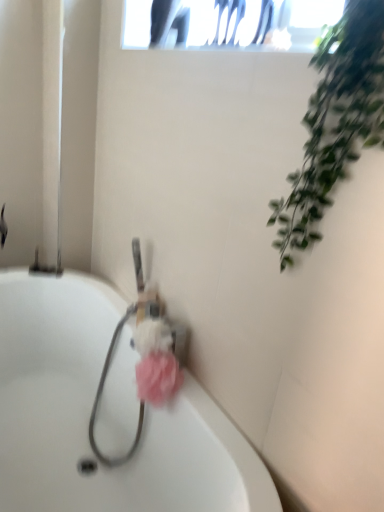
Image resolution: width=384 pixels, height=512 pixels. Describe the element at coordinates (335, 121) in the screenshot. I see `green leafy plant at upper right` at that location.

Identify the location of white glossy bathtub at center. The width and height of the screenshot is (384, 512). (90, 412).

What are the coordinates of `green leafy plant at upper right` in the screenshot? It's located at (335, 121).

The width and height of the screenshot is (384, 512). Identify the location of bathtub that is behind the green leafy plant at upper right. (90, 412).

From the image's perspective, is green leafy plant at upper right below white glossy bathtub at center?

Actually, green leafy plant at upper right appears above white glossy bathtub at center in the image.

From a real-world perspective, is green leafy plant at upper right located beneath white glossy bathtub at center?

No.

In the scene shown: Are green leafy plant at upper right and white glossy bathtub at center far apart?

Actually, green leafy plant at upper right and white glossy bathtub at center are a little close together.

Is pink fluffy sponge at center, which is counted as the first flower, starting from the bottom, surrounded by pink fluffy sponge at center?

No, pink fluffy sponge at center, which is counted as the first flower, starting from the bottom, is located outside of pink fluffy sponge at center.

Where is `sink that is behind the pink fluffy sponge at center, the second flower positioned from the top`? The image size is (384, 512). sink that is behind the pink fluffy sponge at center, the second flower positioned from the top is located at coordinates (115, 344).

In the scene shown: Is pink fluffy sponge at center next to pink fluffy sponge at center, which is counted as the first flower, starting from the bottom?

No, pink fluffy sponge at center is not touching pink fluffy sponge at center, which is counted as the first flower, starting from the bottom.

Is pink fluffy loofah at center, acting as the second flower starting from the bottom, thinner than pink fluffy sponge at center, the second flower positioned from the top?

In fact, pink fluffy loofah at center, acting as the second flower starting from the bottom, might be wider than pink fluffy sponge at center, the second flower positioned from the top.

From the image's perspective, which is above, pink fluffy loofah at center, positioned as the 1th flower in top-to-bottom order, or pink fluffy sponge at center, which is counted as the first flower, starting from the bottom?

pink fluffy loofah at center, positioned as the 1th flower in top-to-bottom order, from the image's perspective.

Which is more to the left, pink fluffy loofah at center, acting as the second flower starting from the bottom, or pink fluffy sponge at center, which is counted as the first flower, starting from the bottom?

pink fluffy loofah at center, acting as the second flower starting from the bottom.

Between pink fluffy sponge at center, which is counted as the first flower, starting from the bottom, and green leafy plant at upper right, which one has less height?

With less height is pink fluffy sponge at center, which is counted as the first flower, starting from the bottom.

From a real-world perspective, is pink fluffy sponge at center, the second flower positioned from the top, above or below green leafy plant at upper right?

Clearly, from a real-world perspective, pink fluffy sponge at center, the second flower positioned from the top, is below green leafy plant at upper right.

Between pink fluffy sponge at center, the second flower positioned from the top, and green leafy plant at upper right, which one is positioned in front?

green leafy plant at upper right is more forward.

From the image's perspective, which one is positioned lower, pink fluffy sponge at center, the second flower positioned from the top, or green leafy plant at upper right?

pink fluffy sponge at center, the second flower positioned from the top, appears lower in the image.

From a real-world perspective, is pink fluffy sponge at center physically located above or below green leafy plant at upper right?

pink fluffy sponge at center is below green leafy plant at upper right.

Can you tell me how much pink fluffy sponge at center and green leafy plant at upper right differ in facing direction?

pink fluffy sponge at center and green leafy plant at upper right are facing 3.44 degrees away from each other.

Which object is more forward, pink fluffy sponge at center or green leafy plant at upper right?

green leafy plant at upper right is in front.

Would you say pink fluffy sponge at center is inside or outside green leafy plant at upper right?

pink fluffy sponge at center exists outside the volume of green leafy plant at upper right.

Considering the positions of point (239, 478) and point (141, 339), is point (239, 478) closer or farther from the camera than point (141, 339)?

Point (239, 478) is positioned closer to the camera compared to point (141, 339).

Which of these two, white glossy bathtub at center or pink fluffy loofah at center, positioned as the 1th flower in top-to-bottom order, stands shorter?

pink fluffy loofah at center, positioned as the 1th flower in top-to-bottom order, is shorter.

Based on the photo, is white glossy bathtub at center positioned with its back to pink fluffy loofah at center, acting as the second flower starting from the bottom?

white glossy bathtub at center does not have its back to pink fluffy loofah at center, acting as the second flower starting from the bottom.

Considering the relative positions of white glossy bathtub at center and pink fluffy loofah at center, acting as the second flower starting from the bottom, in the image provided, is white glossy bathtub at center to the left of pink fluffy loofah at center, acting as the second flower starting from the bottom, from the viewer's perspective?

Yes, white glossy bathtub at center is to the left of pink fluffy loofah at center, acting as the second flower starting from the bottom.

From a real-world perspective, who is located higher, green leafy plant at upper right or pink fluffy loofah at center, positioned as the 1th flower in top-to-bottom order?

From a 3D spatial view, green leafy plant at upper right is above.

Does green leafy plant at upper right have a larger size compared to pink fluffy loofah at center, positioned as the 1th flower in top-to-bottom order?

Indeed, green leafy plant at upper right has a larger size compared to pink fluffy loofah at center, positioned as the 1th flower in top-to-bottom order.

Considering the positions of objects green leafy plant at upper right and pink fluffy loofah at center, acting as the second flower starting from the bottom, in the image provided, who is more to the left, green leafy plant at upper right or pink fluffy loofah at center, acting as the second flower starting from the bottom,?

pink fluffy loofah at center, acting as the second flower starting from the bottom.

Considering the positions of points (346, 138) and (159, 330), is point (346, 138) farther from camera compared to point (159, 330)?

No, (346, 138) is closer to viewer.

This screenshot has width=384, height=512. In the image, there is a green leafy plant at upper right. Find the location of `bathtub below it (from the image's perspective)`. bathtub below it (from the image's perspective) is located at coordinates (90, 412).

Where is `sink on the left side of pink fluffy sponge at center, which is counted as the first flower, starting from the bottom`? Image resolution: width=384 pixels, height=512 pixels. sink on the left side of pink fluffy sponge at center, which is counted as the first flower, starting from the bottom is located at coordinates (115, 344).

When comparing their distances from white glossy bathtub at center, does pink fluffy sponge at center or pink fluffy sponge at center, the second flower positioned from the top, seem further?

The object further to white glossy bathtub at center is pink fluffy sponge at center, the second flower positioned from the top.

Looking at the image, which one is located closer to white glossy bathtub at center, pink fluffy sponge at center or pink fluffy loofah at center, positioned as the 1th flower in top-to-bottom order?

pink fluffy sponge at center lies closer to white glossy bathtub at center than the other object.

When comparing their distances from green leafy plant at upper right, does white glossy bathtub at center or pink fluffy sponge at center seem further?

white glossy bathtub at center lies further to green leafy plant at upper right than the other object.

Considering their positions, is pink fluffy sponge at center positioned further to green leafy plant at upper right than pink fluffy sponge at center, the second flower positioned from the top?

pink fluffy sponge at center is positioned further to the anchor green leafy plant at upper right.

Estimate the real-world distances between objects in this image. Which object is closer to pink fluffy sponge at center, which is counted as the first flower, starting from the bottom, green leafy plant at upper right or pink fluffy sponge at center?

pink fluffy sponge at center.

Based on their spatial positions, is white glossy bathtub at center or pink fluffy sponge at center, the second flower positioned from the top, further from pink fluffy sponge at center?

Among the two, pink fluffy sponge at center, the second flower positioned from the top, is located further to pink fluffy sponge at center.

From the image, which object appears to be farther from pink fluffy sponge at center, the second flower positioned from the top, green leafy plant at upper right or pink fluffy loofah at center, acting as the second flower starting from the bottom?

green leafy plant at upper right lies further to pink fluffy sponge at center, the second flower positioned from the top, than the other object.

Estimate the real-world distances between objects in this image. Which object is closer to pink fluffy sponge at center, the second flower positioned from the top, green leafy plant at upper right or white glossy bathtub at center?

white glossy bathtub at center is closer to pink fluffy sponge at center, the second flower positioned from the top.

This screenshot has height=512, width=384. I want to click on flower between pink fluffy loofah at center, acting as the second flower starting from the bottom, and pink fluffy sponge at center vertically, so click(x=158, y=377).

Where is `sink between green leafy plant at upper right and white glossy bathtub at center vertically`? This screenshot has width=384, height=512. sink between green leafy plant at upper right and white glossy bathtub at center vertically is located at coordinates (115, 344).

Where is `flower positioned between green leafy plant at upper right and pink fluffy loofah at center, acting as the second flower starting from the bottom, from near to far`? flower positioned between green leafy plant at upper right and pink fluffy loofah at center, acting as the second flower starting from the bottom, from near to far is located at coordinates (158, 377).

Find the location of a particular element. The height and width of the screenshot is (512, 384). flower between white glossy bathtub at center and pink fluffy loofah at center, acting as the second flower starting from the bottom, from front to back is located at coordinates (158, 377).